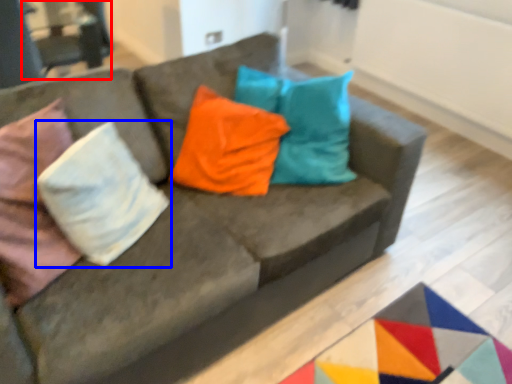
Question: Among these objects, which one is nearest to the camera, armchair (highlighted by a red box) or pillow (highlighted by a blue box)?

Choices:
 (A) armchair
 (B) pillow

Answer: (B)